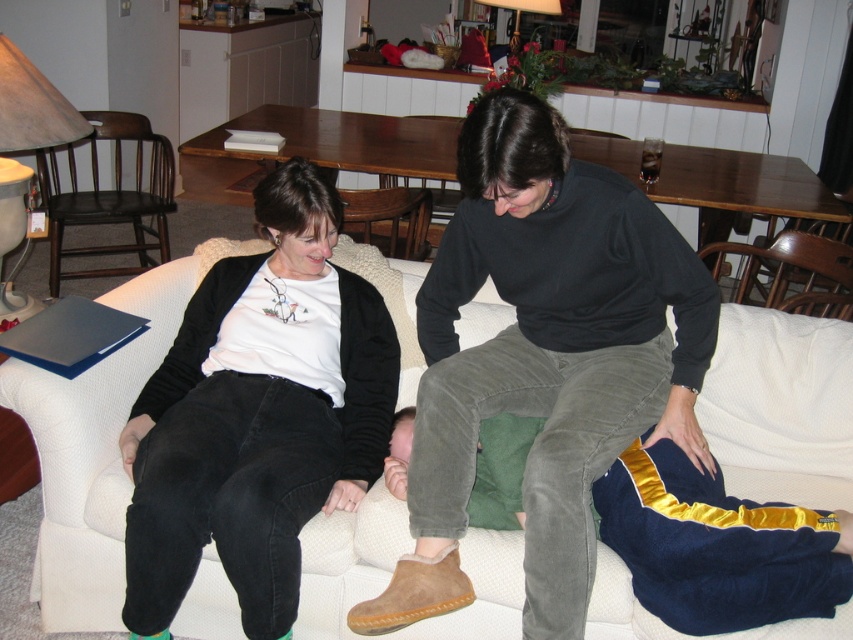
Does white fabric couch at center have a greater width compared to white fabric armchair at center?

Correct, the width of white fabric couch at center exceeds that of white fabric armchair at center.

Can you confirm if white fabric couch at center is thinner than white fabric armchair at center?

Incorrect, white fabric couch at center's width is not less than white fabric armchair at center's.

At what (x,y) coordinates should I click in order to perform the action: click on white fabric couch at center. Please return your answer as a coordinate pair (x, y). The image size is (853, 640). Looking at the image, I should click on (91, 451).

Is wooden lampshade at left to the left of brown wooden chair at right from the viewer's perspective?

Correct, you'll find wooden lampshade at left to the left of brown wooden chair at right.

Can you confirm if wooden lampshade at left is taller than brown wooden chair at right?

Yes, wooden lampshade at left is taller than brown wooden chair at right.

You are a GUI agent. You are given a task and a screenshot of the screen. Output one action in this format:
    pyautogui.click(x=<x>, y=<y>)
    Task: Click on the wooden lampshade at left
    The height and width of the screenshot is (640, 853).
    Given the screenshot: What is the action you would take?
    pyautogui.click(x=32, y=106)

Does dark brown wood chair at left appear over white fabric armchair at center?

Indeed, dark brown wood chair at left is positioned over white fabric armchair at center.

Between point (84, 198) and point (347, 188), which one is positioned in front?

Point (84, 198) is in front.

Locate an element on the screen. dark brown wood chair at left is located at coordinates (109, 195).